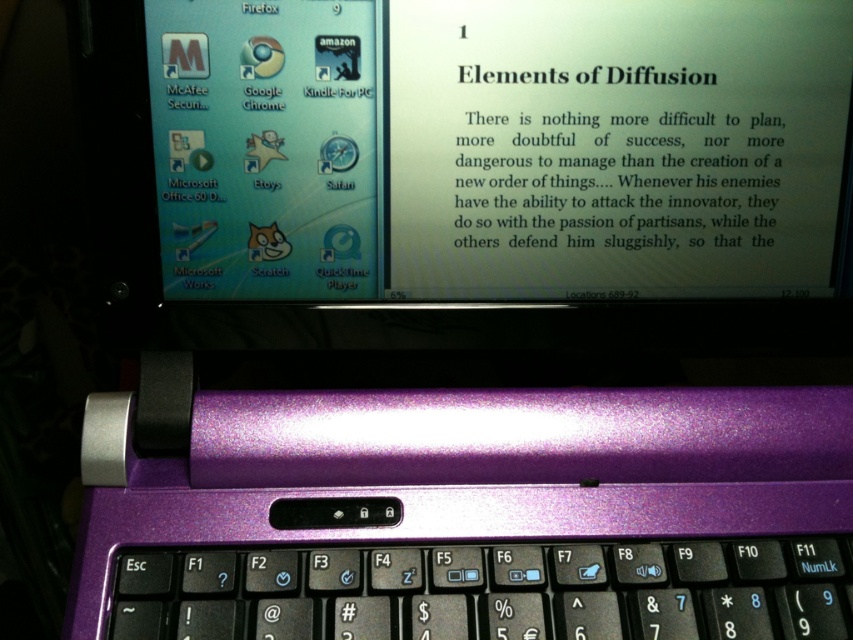
You are setting up a workspace and need to place both the purple metallic laptop at upper center and the purple metallic keyboard at center on a desk. Based on their widths, which object should be placed first to ensure they fit side by side?

The purple metallic laptop at upper center might be wider than the purple metallic keyboard at center, so it should be placed first to accommodate its width when arranging them side by side.

You are setting up a laptop and keyboard on a desk. The purple metallic laptop at upper center needs to be placed on top of the purple metallic keyboard at center. Is this possible given their positions?

The purple metallic laptop at upper center is positioned over the purple metallic keyboard at center, so yes, placing the purple metallic laptop at upper center on top of the purple metallic keyboard at center is possible since it is already positioned over it.

You have a small USB drive that is 3 centimeters long. You want to place it between the purple metallic laptop at upper center and the purple metallic keyboard at center. Will there be enough space for the USB drive to fit between them?

The purple metallic laptop at upper center is 19.52 centimeters away from the purple metallic keyboard at center. Since the USB drive is only 3 centimeters long, there is more than enough space to place it between them.